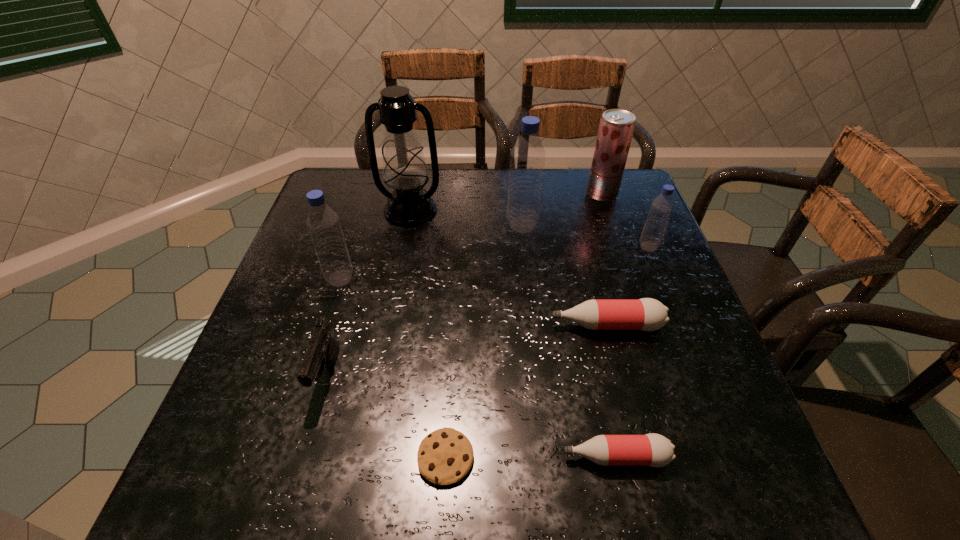
Find the location of a particular element. This screenshot has height=540, width=960. oil lamp at the far edge is located at coordinates (404, 168).

Locate an element on the screen. This screenshot has height=540, width=960. bottle that is at the far edge is located at coordinates (527, 158).

Locate an element on the screen. This screenshot has height=540, width=960. fruit juice that is at the far edge is located at coordinates (616, 128).

I want to click on bottle at the near edge, so click(x=655, y=450).

I want to click on cookie located in the near edge section of the desktop, so click(x=445, y=456).

Image resolution: width=960 pixels, height=540 pixels. I want to click on bottle that is at the left edge, so click(323, 223).

Find the location of `pistol that is at the left edge`. pistol that is at the left edge is located at coordinates (323, 350).

Where is `fruit juice that is at the right edge`? The image size is (960, 540). fruit juice that is at the right edge is located at coordinates (616, 128).

Where is `object that is at the far right corner`? object that is at the far right corner is located at coordinates (616, 128).

I want to click on object at the near right corner, so click(x=655, y=450).